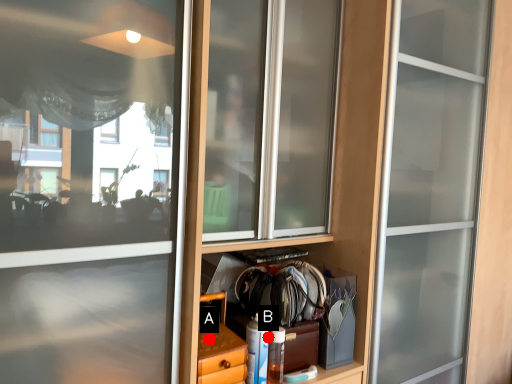
Question: Two points are circled on the image, labeled by A and B beside each circle. Which point appears farthest from the camera in this image?

Choices:
 (A) A is further
 (B) B is further

Answer: (B)